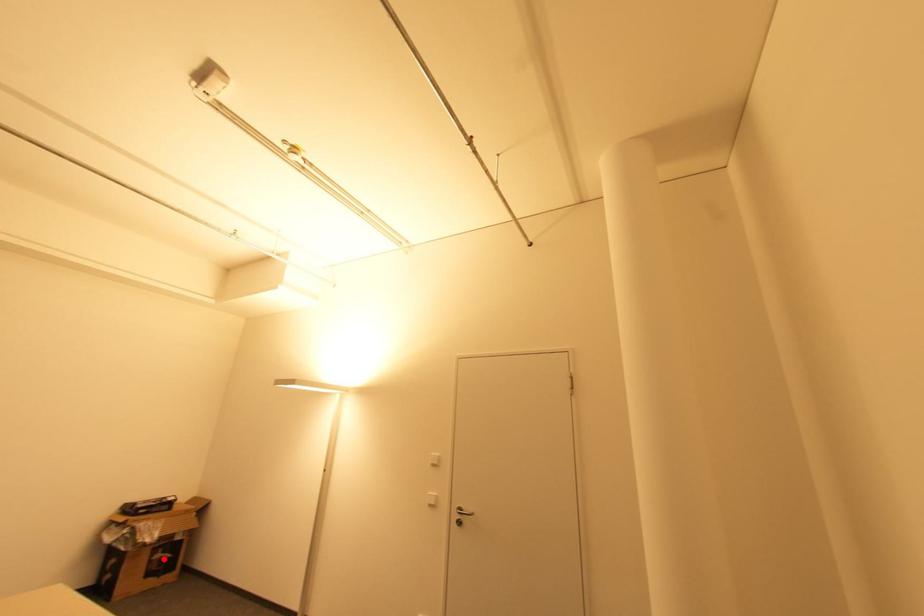
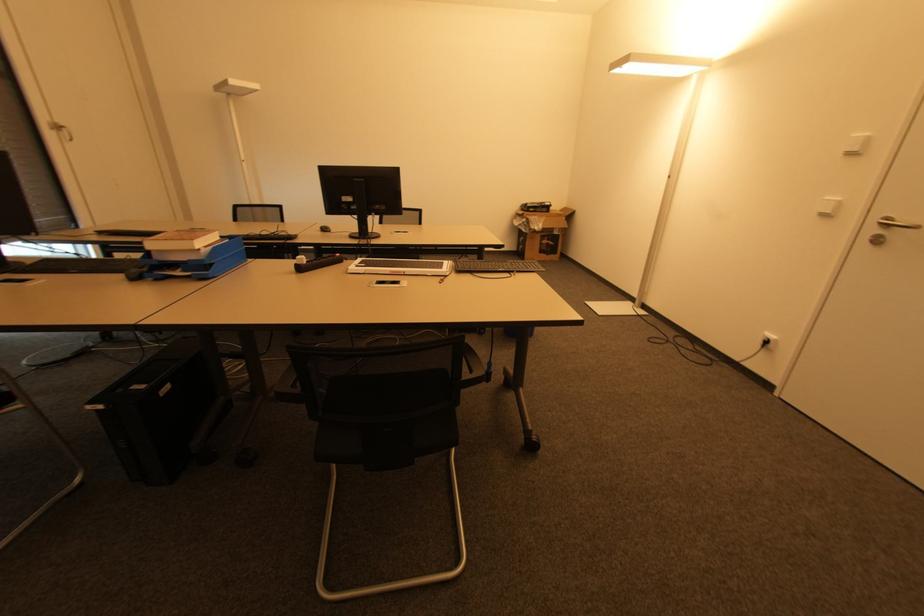
Question: I am providing you with two images of the same scene from different viewpoints. Image1 has a red point marked. In image2, the corresponding 3D location appears at what relative position? Reply with the corresponding letter.

Choices:
 (A) Closer
 (B) Farther

Answer: (A)